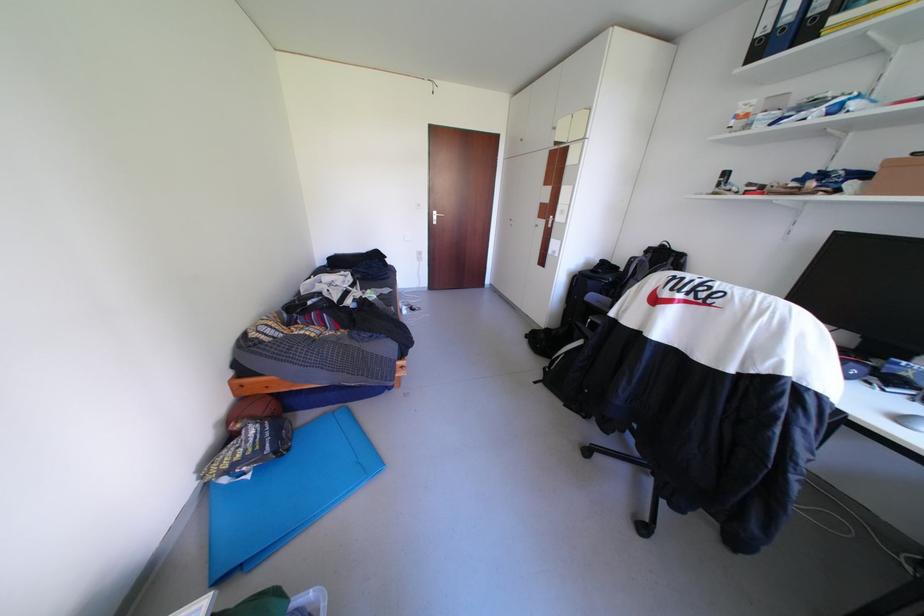
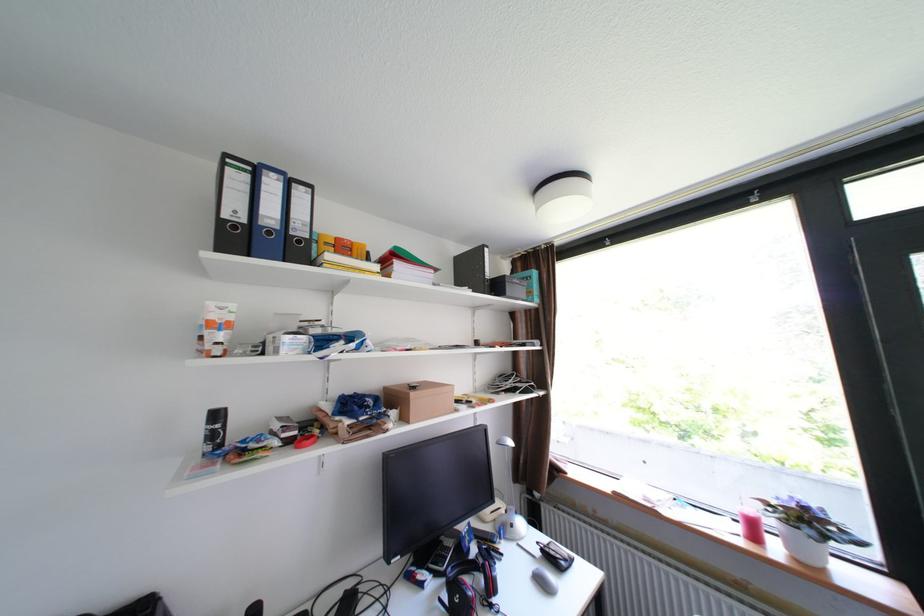
Where in the second image is the point corresponding to (764,42) from the first image?

(232, 221)